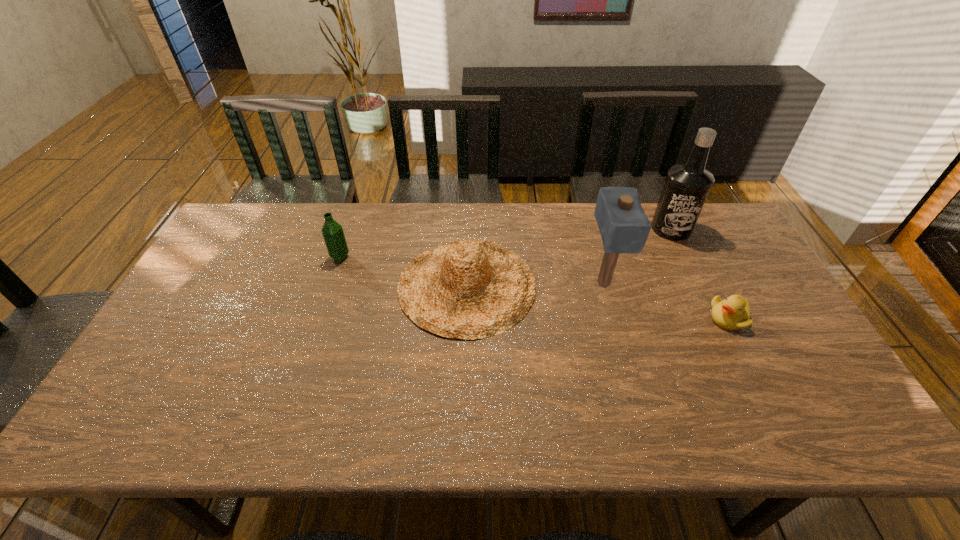
The image size is (960, 540). Identify the location of vacant area between the second shortest object and the duckling. (598, 302).

You are a GUI agent. You are given a task and a screenshot of the screen. Output one action in this format:
    pyautogui.click(x=<x>, y=<y>)
    Task: Click on the free point between the fourth object from right to left and the liquor
    Image resolution: width=960 pixels, height=540 pixels.
    Given the screenshot: What is the action you would take?
    pyautogui.click(x=569, y=257)

Identify which object is the nearest to the third object from right to left. Please provide its 2D coordinates. Your answer should be formatted as a tuple, i.e. [(x, y)], where the tuple contains the x and y coordinates of a point satisfying the conditions above.

[(468, 289)]

Point out which object is positioned as the nearest to the third object from right to left. Please provide its 2D coordinates. Your answer should be formatted as a tuple, i.e. [(x, y)], where the tuple contains the x and y coordinates of a point satisfying the conditions above.

[(468, 289)]